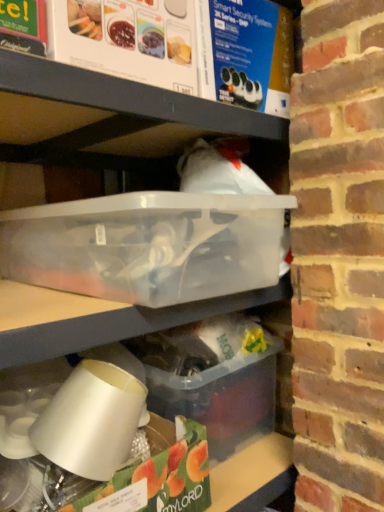
Question: Is point (132, 338) positioned closer to the camera than point (266, 217)?

Choices:
 (A) closer
 (B) farther

Answer: (B)

Question: From a real-world perspective, relative to transparent plastic container at center, the 1th box when ordered from top to bottom, is translucent plastic container at lower center, which is counted as the second box, starting from the top, vertically above or below?

Choices:
 (A) above
 (B) below

Answer: (B)

Question: Do you think translucent plastic container at lower center, which is counted as the second box, starting from the top, is within transparent plastic container at center, the 1th box when ordered from top to bottom, or outside of it?

Choices:
 (A) inside
 (B) outside

Answer: (B)

Question: In terms of size, does transparent plastic container at center, the 1th box when ordered from top to bottom, appear bigger or smaller than translucent plastic container at lower center, which is counted as the second box, starting from the top?

Choices:
 (A) small
 (B) big

Answer: (B)

Question: From a real-world perspective, is transparent plastic container at center, the 2th box from the bottom, above or below translucent plastic container at lower center, which is counted as the second box, starting from the top?

Choices:
 (A) above
 (B) below

Answer: (A)

Question: Do you think transparent plastic container at center, the 1th box when ordered from top to bottom, is within translucent plastic container at lower center, which is counted as the second box, starting from the top, or outside of it?

Choices:
 (A) outside
 (B) inside

Answer: (A)

Question: From their relative heights in the image, would you say transparent plastic container at center, the 2th box from the bottom, is taller or shorter than translucent plastic container at lower center, the first box when ordered from bottom to top?

Choices:
 (A) tall
 (B) short

Answer: (B)